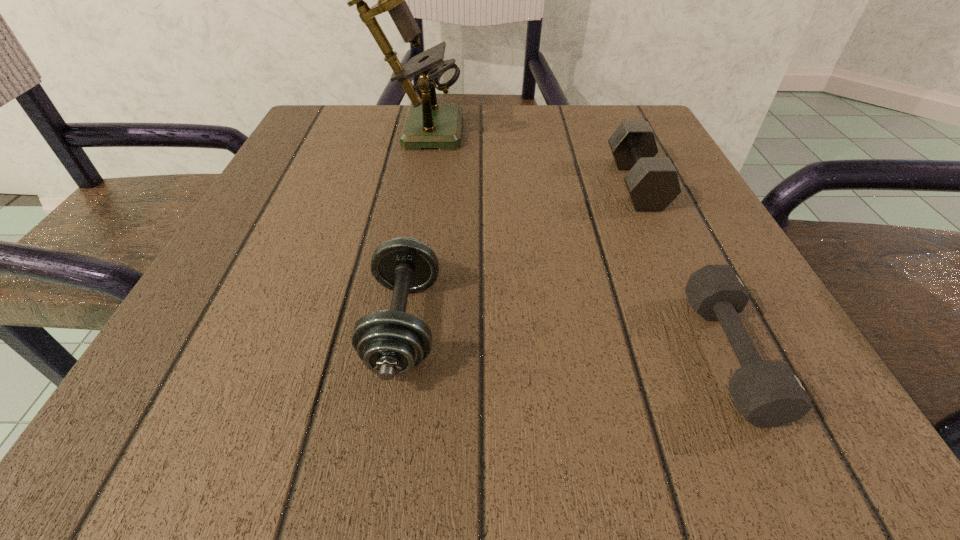
The width and height of the screenshot is (960, 540). Identify the location of vacant area in the image that satisfies the following two spatial constraints: 1. at the eyepiece of the farthest object; 2. on the back side of the shortest dumbbell. (362, 354).